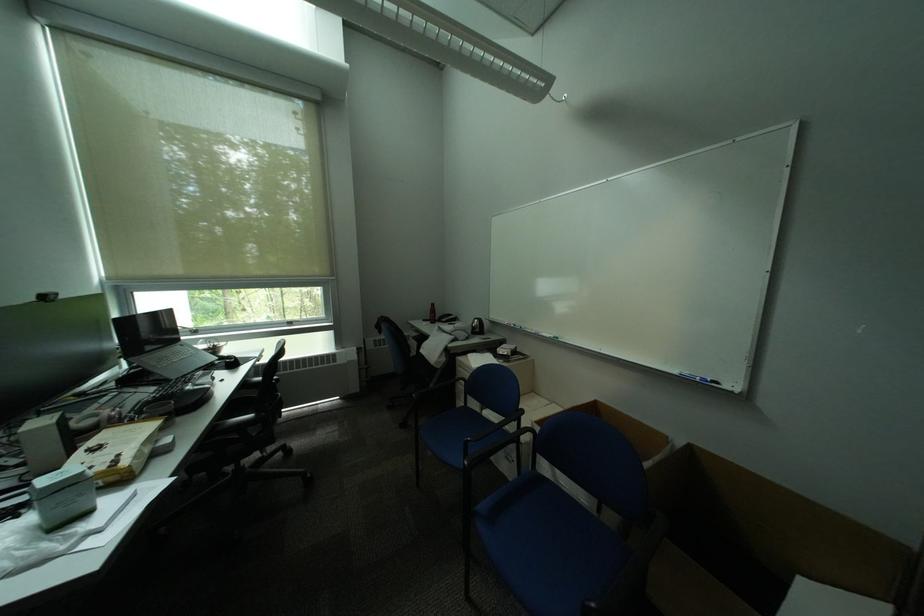
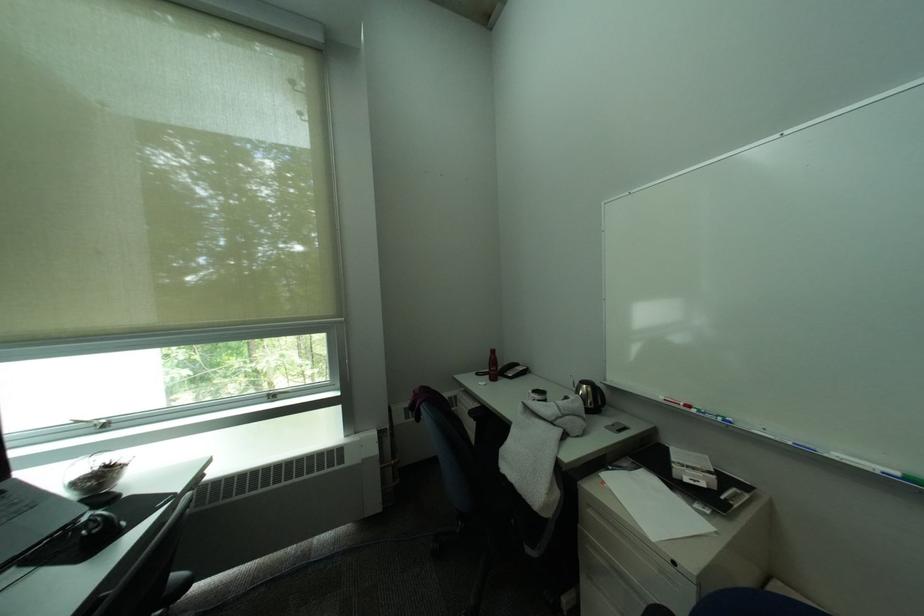
Where in the second image is the point corresponding to (244,360) from the first image?

(106, 528)